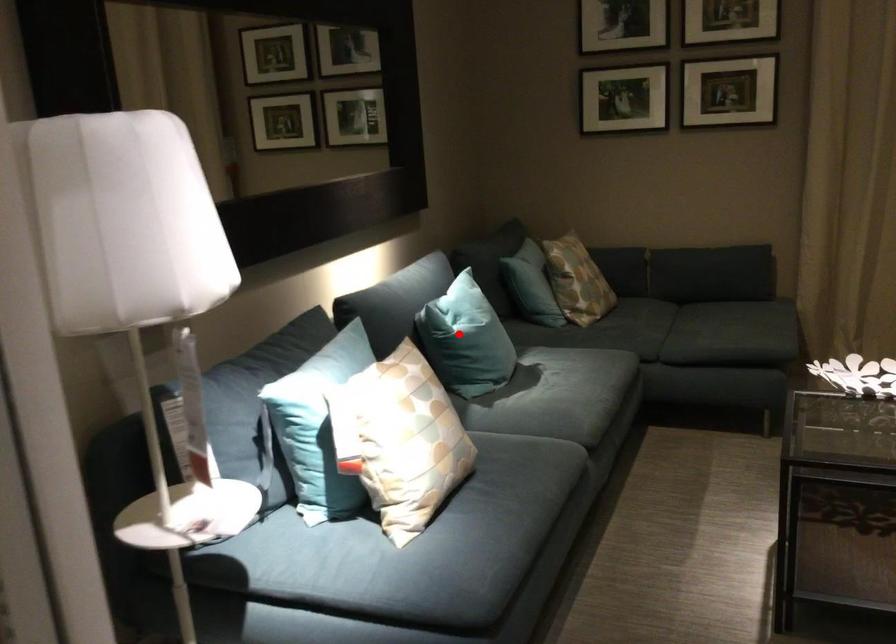
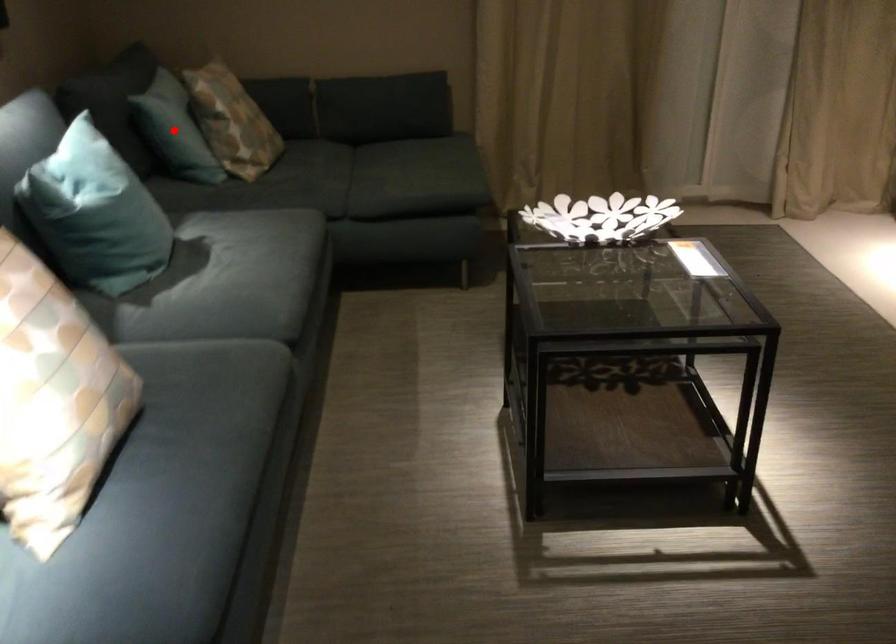
I am providing you with two images of the same scene from different viewpoints. A red point is marked on the first image and another point is marked on the second image. Are the points marked in image1 and image2 representing the same 3D position?

No